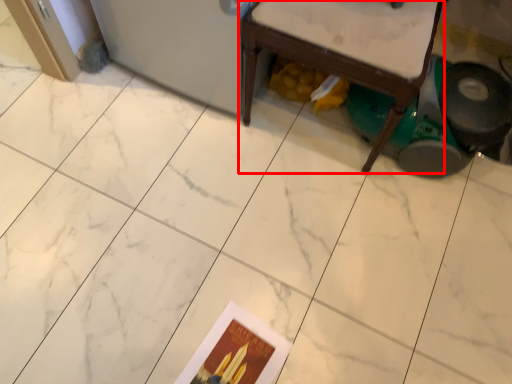
Question: Considering the relative positions of furniture (annotated by the red box) and postcard in the image provided, where is furniture (annotated by the red box) located with respect to the staircase?

Choices:
 (A) right
 (B) left

Answer: (A)